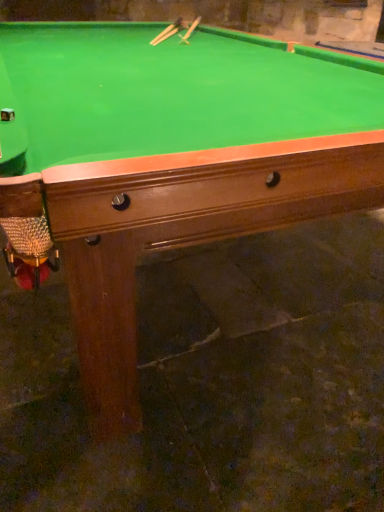
Question: Considering the relative positions of wooden cue at upper center, which is the 1th cue from right to left, and wooden cue at upper center, arranged as the first cue when viewed from the left, in the image provided, is wooden cue at upper center, which is the 1th cue from right to left, to the left or to the right of wooden cue at upper center, arranged as the first cue when viewed from the left,?

Choices:
 (A) left
 (B) right

Answer: (B)

Question: In terms of size, does wooden cue at upper center, arranged as the second cue when viewed from the left, appear bigger or smaller than wooden cue at upper center, arranged as the first cue when viewed from the left?

Choices:
 (A) small
 (B) big

Answer: (B)

Question: From the image's perspective, relative to wooden cue at upper center, arranged as the first cue when viewed from the left, is wooden cue at upper center, which is the 1th cue from right to left, above or below?

Choices:
 (A) below
 (B) above

Answer: (B)

Question: From the image's perspective, relative to wooden cue at upper center, which is the 1th cue from right to left, is wooden cue at upper center, arranged as the 2th cue when viewed from the right, above or below?

Choices:
 (A) below
 (B) above

Answer: (A)

Question: Visually, is wooden cue at upper center, arranged as the first cue when viewed from the left, positioned to the left or to the right of wooden cue at upper center, arranged as the second cue when viewed from the left?

Choices:
 (A) right
 (B) left

Answer: (B)

Question: Is wooden cue at upper center, arranged as the 2th cue when viewed from the right, in front of or behind wooden cue at upper center, arranged as the second cue when viewed from the left, in the image?

Choices:
 (A) behind
 (B) front

Answer: (B)

Question: From their relative heights in the image, would you say wooden cue at upper center, arranged as the first cue when viewed from the left, is taller or shorter than wooden cue at upper center, which is the 1th cue from right to left?

Choices:
 (A) short
 (B) tall

Answer: (A)